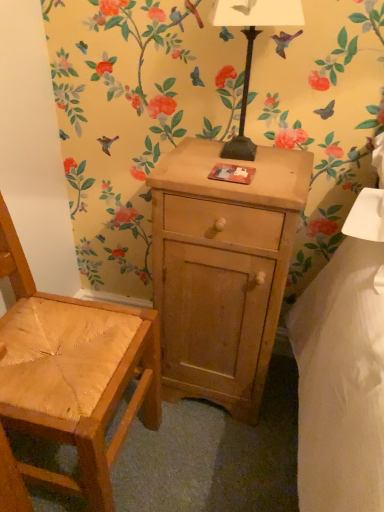
Where is `space that is in front of metallic black lamp at upper center`? The image size is (384, 512). space that is in front of metallic black lamp at upper center is located at coordinates (243, 186).